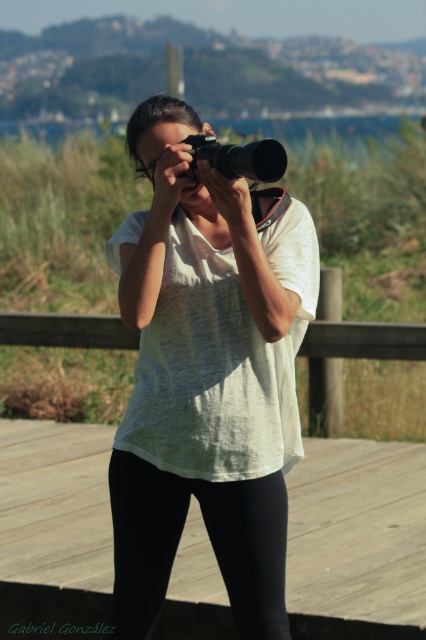
You are a photographer trying to decide where to place your matte black camera at center so it doesn t block your view of the black leggings at lower center. Based on their sizes, which object should be placed closer to you to ensure visibility?

The black leggings at lower center is smaller than the matte black camera at center. To ensure visibility of the black leggings at lower center, the matte black camera at center should be placed further away from you so the smaller black leggings at lower center can be seen without obstruction.

Based on the photo, you are a photographer trying to capture the scenic view of the bay. You notice the black leggings at lower center and the matte black camera at center. Which object is positioned lower in the image?

The black leggings at lower center is located below the matte black camera at center, so it is positioned lower in the image.